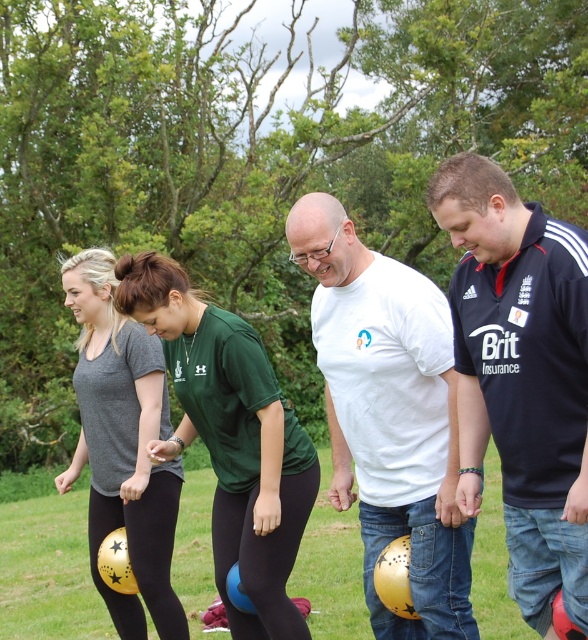
Question: Which point is closer to the camera taking this photo?

Choices:
 (A) (447, 557)
 (B) (159, 513)
 (C) (492, 413)
 (D) (268, 449)

Answer: (C)

Question: Which of the following is the farthest from the observer?

Choices:
 (A) green matte shirt at center
 (B) white matte t-shirt at center
 (C) matte gray t-shirt at center

Answer: (C)

Question: Does white matte t-shirt at center appear over matte gray t-shirt at center?

Choices:
 (A) yes
 (B) no

Answer: (A)

Question: Does dark blue jersey at center come behind green matte shirt at center?

Choices:
 (A) no
 (B) yes

Answer: (A)

Question: Is green matte shirt at center above matte gray t-shirt at center?

Choices:
 (A) yes
 (B) no

Answer: (A)

Question: Which of the following is the farthest from the observer?

Choices:
 (A) green matte shirt at center
 (B) dark blue jersey at center
 (C) white matte t-shirt at center

Answer: (A)